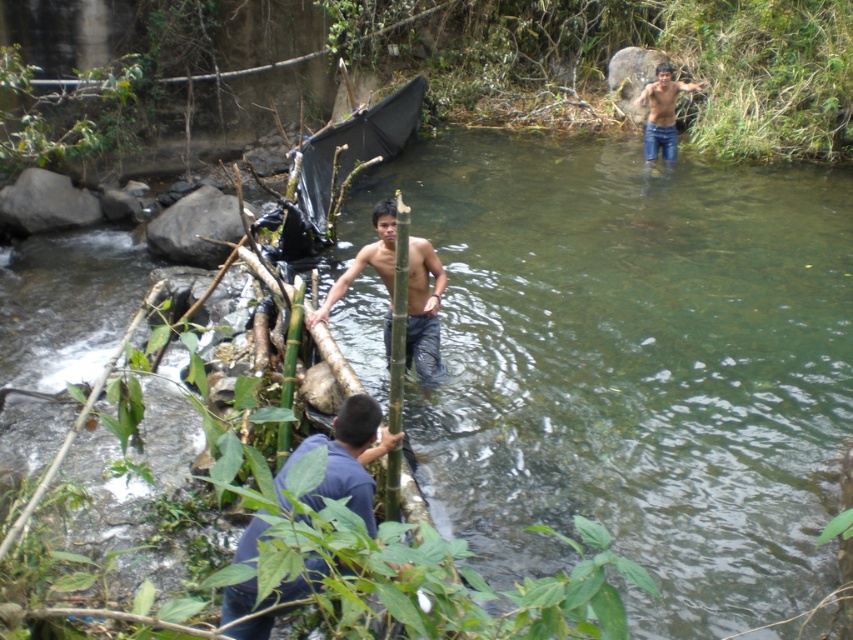
Between clear water at center and smooth skin man at center, which one has more height?

clear water at center

Does point (695, 492) come in front of point (422, 369)?

Yes, point (695, 492) is closer to viewer.

Locate an element on the screen. This screenshot has width=853, height=640. clear water at center is located at coordinates (633, 364).

Does clear water at center have a greater width compared to jeans at upper right?

Yes, clear water at center is wider than jeans at upper right.

Does clear water at center appear over jeans at upper right?

Incorrect, clear water at center is not positioned above jeans at upper right.

The height and width of the screenshot is (640, 853). In order to click on clear water at center in this screenshot , I will do `click(633, 364)`.

The height and width of the screenshot is (640, 853). Find the location of `clear water at center`. clear water at center is located at coordinates (633, 364).

Which of these two, clear water at center or blue cotton shirt at lower center, stands shorter?

blue cotton shirt at lower center is shorter.

What do you see at coordinates (633, 364) in the screenshot? The width and height of the screenshot is (853, 640). I see `clear water at center` at bounding box center [633, 364].

Locate an element on the screen. This screenshot has width=853, height=640. clear water at center is located at coordinates (633, 364).

Identify the location of clear water at center. (633, 364).